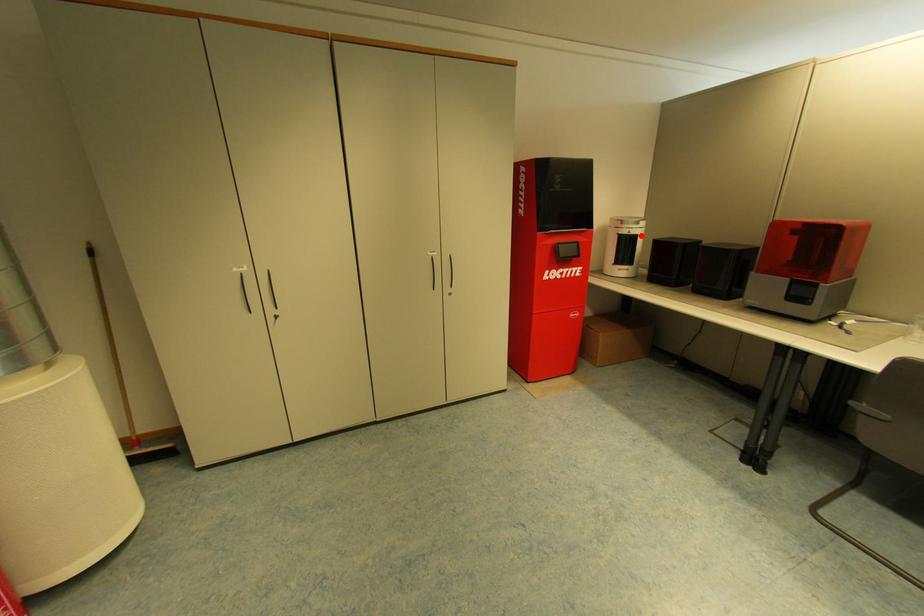
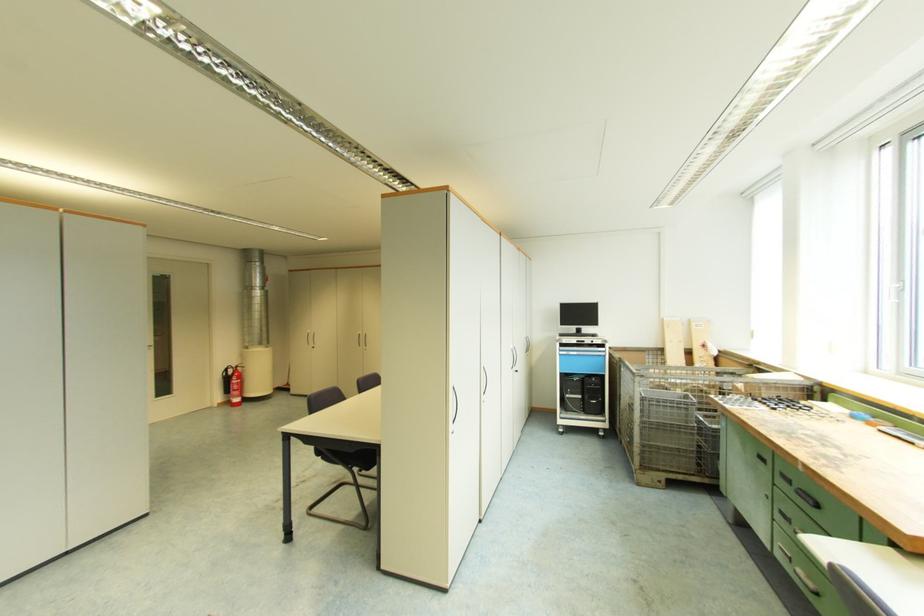
Question: I am providing you with two images of the same scene from different viewpoints. A red point is marked on the first image. Is the red point's position out of view in image 2?

Choices:
 (A) Yes
 (B) No

Answer: (A)